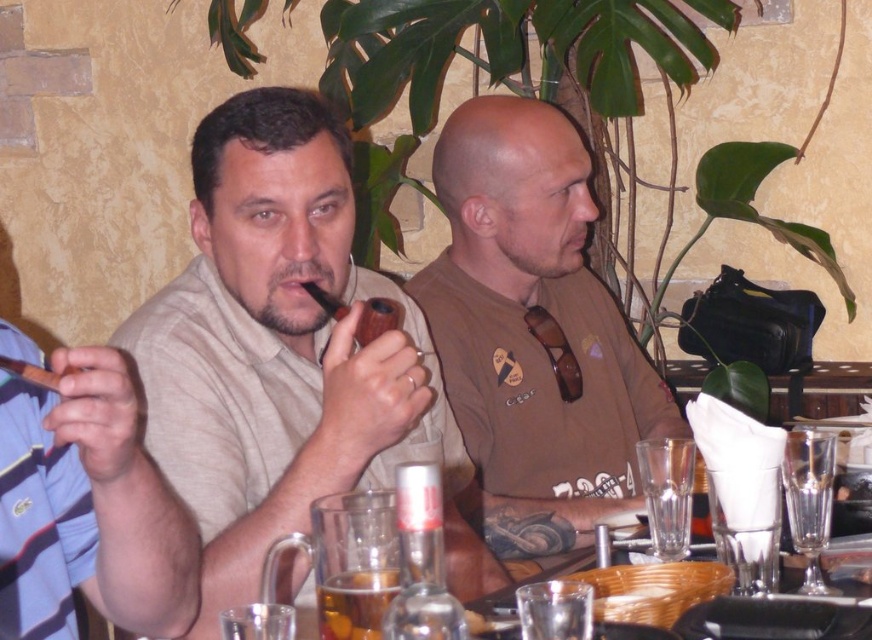
Question: Can you confirm if brown matte shirt at center is smaller than translucent glass mug at lower center?

Choices:
 (A) yes
 (B) no

Answer: (B)

Question: Which point is closer to the camera?

Choices:
 (A) matte brown pipe at center
 (B) brown matte shirt at center
 (C) brown wooden pipe at left

Answer: (C)

Question: Where is matte brown pipe at center located in relation to brown wooden pipe at left in the image?

Choices:
 (A) above
 (B) below

Answer: (A)

Question: Among these points, which one is nearest to the camera?

Choices:
 (A) (356, 577)
 (B) (291, 291)

Answer: (A)

Question: Can you confirm if brown matte shirt at center is thinner than translucent glass mug at lower center?

Choices:
 (A) yes
 (B) no

Answer: (B)

Question: Which point is closer to the camera?

Choices:
 (A) (232, 477)
 (B) (393, 579)
 (C) (19, 497)

Answer: (B)